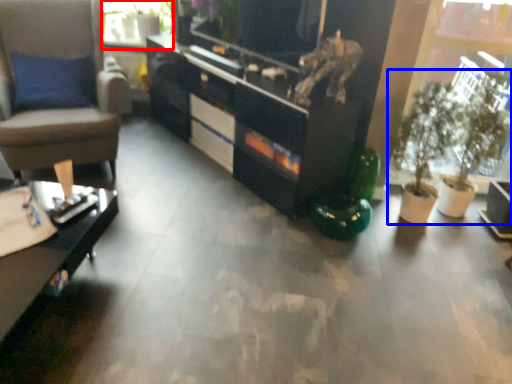
Question: Among these objects, which one is farthest to the camera, window screen (highlighted by a red box) or houseplant (highlighted by a blue box)?

Choices:
 (A) window screen
 (B) houseplant

Answer: (A)